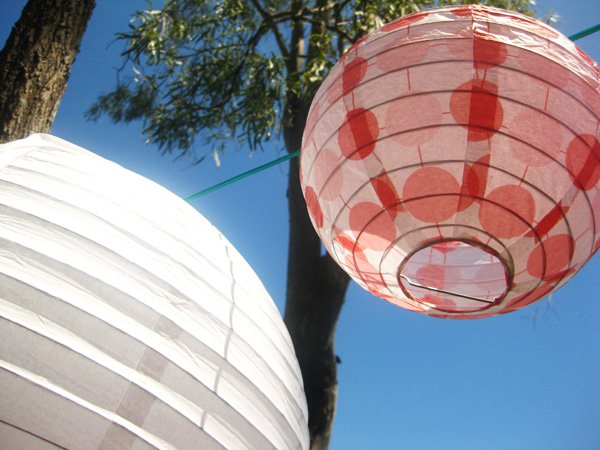
The height and width of the screenshot is (450, 600). What are the coordinates of `paper lantern` in the screenshot? It's located at (79, 348), (426, 174).